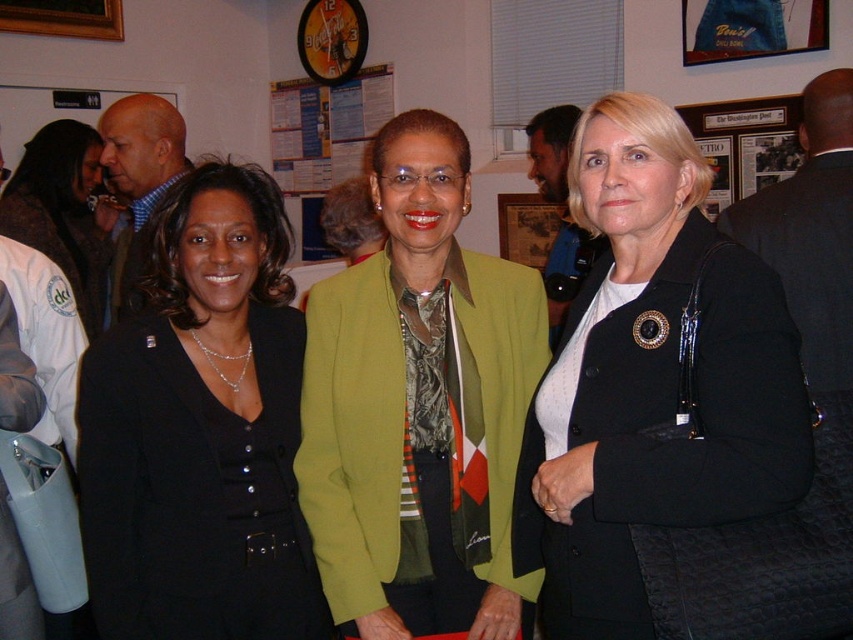
Question: Can you confirm if black quilted jacket at center is positioned to the right of wooden framed picture at center?

Choices:
 (A) no
 (B) yes

Answer: (A)

Question: Which point is closer to the camera?

Choices:
 (A) (346, 122)
 (B) (51, 248)

Answer: (B)

Question: Is matte black blazer at left below wooden framed picture at center?

Choices:
 (A) yes
 (B) no

Answer: (A)

Question: Is black matte suit at left below paper posters at center?

Choices:
 (A) yes
 (B) no

Answer: (A)

Question: Which point is farther to the camera?

Choices:
 (A) denim fabric picture frame at upper right
 (B) paper posters at center

Answer: (B)

Question: Which object is closer to the camera taking this photo?

Choices:
 (A) matte black blazer at left
 (B) denim fabric picture frame at upper right
 (C) black quilted jacket at center
 (D) wooden framed picture at center

Answer: (C)